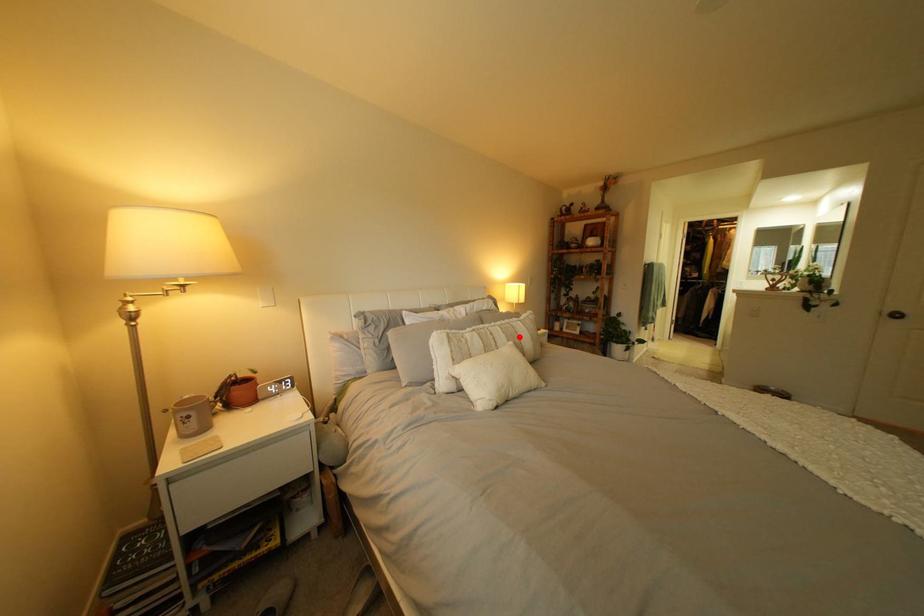
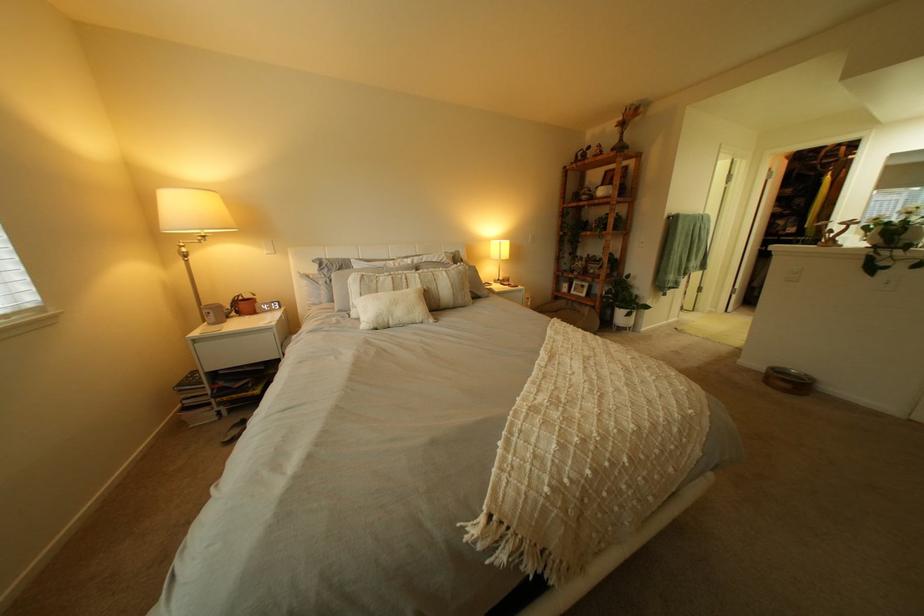
Locate, in the second image, the point that corresponds to the highlighted location in the first image.

(434, 283)